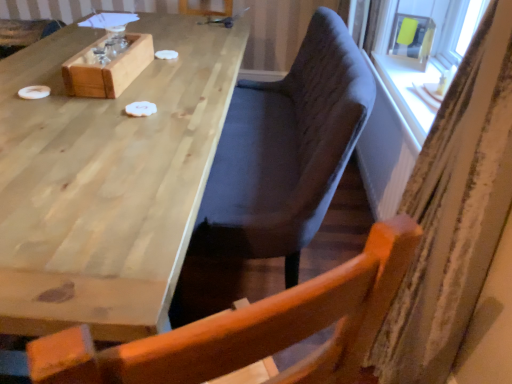
Describe the element at coordinates (454, 211) in the screenshot. I see `striped fabric curtain at right` at that location.

In order to face matte yellow plastic at upper right, should I rotate leftwards or rightwards?

A 19.919 degree turn to the right will do.

What is the approximate height of velvet dark blue chair at center?

It is 37.31 inches.

Image resolution: width=512 pixels, height=384 pixels. What do you see at coordinates (285, 151) in the screenshot?
I see `velvet dark blue chair at center` at bounding box center [285, 151].

Locate an element on the screen. striped fabric curtain at right is located at coordinates (x=454, y=211).

Can we say striped fabric curtain at right lies outside natural wood table at upper left?

Yes, striped fabric curtain at right is located beyond the bounds of natural wood table at upper left.

Is striped fabric curtain at right oriented away from natural wood table at upper left?

That's not correct — striped fabric curtain at right is not looking away from natural wood table at upper left.

At what (x,y) coordinates should I click in order to perform the action: click on table that is on the left side of velvet dark blue chair at center. Please return your answer as a coordinate pair (x, y). The height and width of the screenshot is (384, 512). Looking at the image, I should click on (106, 180).

Looking at this image, can you confirm if natural wood table at upper left is positioned to the right of velvet dark blue chair at center?

No, natural wood table at upper left is not to the right of velvet dark blue chair at center.

Is natural wood table at upper left wider than velvet dark blue chair at center?

Correct, the width of natural wood table at upper left exceeds that of velvet dark blue chair at center.

How much distance is there between natural wood table at upper left and velvet dark blue chair at center?

natural wood table at upper left is 14.98 inches away from velvet dark blue chair at center.

Based on their positions, is matte yellow plastic at upper right located to the left or right of natural wood table at upper left?

matte yellow plastic at upper right is to the right of natural wood table at upper left.

Choose the correct answer: Is matte yellow plastic at upper right inside natural wood table at upper left or outside it?

matte yellow plastic at upper right is not inside natural wood table at upper left, it's outside.

Who is bigger, matte yellow plastic at upper right or natural wood table at upper left?

Bigger between the two is natural wood table at upper left.

Who is more distant, matte yellow plastic at upper right or natural wood table at upper left?

matte yellow plastic at upper right is further from the camera.

Between velvet dark blue chair at center and matte yellow plastic at upper right, which one appears on the right side from the viewer's perspective?

Positioned to the right is matte yellow plastic at upper right.

Considering the relative sizes of velvet dark blue chair at center and matte yellow plastic at upper right in the image provided, is velvet dark blue chair at center thinner than matte yellow plastic at upper right?

In fact, velvet dark blue chair at center might be wider than matte yellow plastic at upper right.

Looking at this image, which of these two, velvet dark blue chair at center or matte yellow plastic at upper right, stands shorter?

matte yellow plastic at upper right.

From the image's perspective, is velvet dark blue chair at center positioned above or below matte yellow plastic at upper right?

Clearly, from the image's perspective, velvet dark blue chair at center is below matte yellow plastic at upper right.

Which object is positioned more to the right, velvet dark blue chair at center or striped fabric curtain at right?

striped fabric curtain at right is more to the right.

Looking at this image, is velvet dark blue chair at center directly adjacent to striped fabric curtain at right?

No, velvet dark blue chair at center is not beside striped fabric curtain at right.

Is velvet dark blue chair at center taller than striped fabric curtain at right?

Incorrect, the height of velvet dark blue chair at center is not larger of that of striped fabric curtain at right.

From a real-world perspective, who is located lower, velvet dark blue chair at center or striped fabric curtain at right?

velvet dark blue chair at center.

Image resolution: width=512 pixels, height=384 pixels. I want to click on chair lying in front of the matte yellow plastic at upper right, so click(x=285, y=151).

Between point (432, 22) and point (301, 181), which one is positioned in front?

The point (301, 181) is in front.

Is matte yellow plastic at upper right in contact with velvet dark blue chair at center?

No, matte yellow plastic at upper right is not touching velvet dark blue chair at center.

Considering the positions of point (7, 297) and point (415, 27), is point (7, 297) closer or farther from the camera than point (415, 27)?

Clearly, point (7, 297) is closer to the camera than point (415, 27).

Locate an element on the screen. This screenshot has width=512, height=384. window screen lying on the right of natural wood table at upper left is located at coordinates pyautogui.click(x=412, y=36).

From the picture: Would you consider natural wood table at upper left to be distant from matte yellow plastic at upper right?

natural wood table at upper left is far away from matte yellow plastic at upper right.

How much distance is there between natural wood table at upper left and matte yellow plastic at upper right?

natural wood table at upper left and matte yellow plastic at upper right are 4.52 feet apart.

Where is `curtain below the natural wood table at upper left (from the image's perspective)`? This screenshot has height=384, width=512. curtain below the natural wood table at upper left (from the image's perspective) is located at coordinates (454, 211).

In the image, there is a velvet dark blue chair at center. Identify the location of table below it (from a real-world perspective). The height and width of the screenshot is (384, 512). (106, 180).

Considering their positions, is striped fabric curtain at right positioned closer to matte yellow plastic at upper right than velvet dark blue chair at center?

The object closer to matte yellow plastic at upper right is velvet dark blue chair at center.

Which object lies nearer to the anchor point natural wood table at upper left, matte yellow plastic at upper right or velvet dark blue chair at center?

velvet dark blue chair at center is positioned closer to the anchor natural wood table at upper left.

Estimate the real-world distances between objects in this image. Which object is further from matte yellow plastic at upper right, velvet dark blue chair at center or natural wood table at upper left?

natural wood table at upper left lies further to matte yellow plastic at upper right than the other object.

When comparing their distances from natural wood table at upper left, does velvet dark blue chair at center or matte yellow plastic at upper right seem further?

Based on the image, matte yellow plastic at upper right appears to be further to natural wood table at upper left.

Looking at this image, when comparing their distances from velvet dark blue chair at center, does matte yellow plastic at upper right or striped fabric curtain at right seem further?

matte yellow plastic at upper right is further to velvet dark blue chair at center.

Estimate the real-world distances between objects in this image. Which object is closer to natural wood table at upper left, velvet dark blue chair at center or striped fabric curtain at right?

velvet dark blue chair at center is closer to natural wood table at upper left.

When comparing their distances from striped fabric curtain at right, does velvet dark blue chair at center or natural wood table at upper left seem closer?

The object closer to striped fabric curtain at right is velvet dark blue chair at center.

Estimate the real-world distances between objects in this image. Which object is further from velvet dark blue chair at center, natural wood table at upper left or striped fabric curtain at right?

striped fabric curtain at right is further to velvet dark blue chair at center.

Find the location of a particular element. The image size is (512, 384). chair between natural wood table at upper left and striped fabric curtain at right is located at coordinates click(285, 151).

Identify the location of chair between striped fabric curtain at right and matte yellow plastic at upper right from front to back. (285, 151).

I want to click on table positioned between striped fabric curtain at right and matte yellow plastic at upper right from near to far, so click(x=106, y=180).

Where is `chair between natural wood table at upper left and matte yellow plastic at upper right from front to back`? chair between natural wood table at upper left and matte yellow plastic at upper right from front to back is located at coordinates (285, 151).